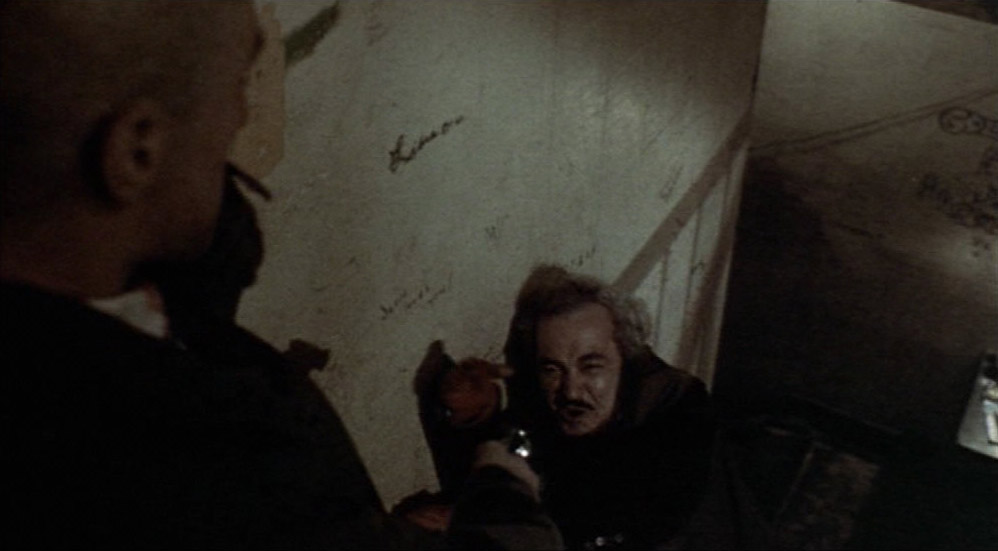
Image resolution: width=998 pixels, height=551 pixels. Find the location of `wall`. wall is located at coordinates [554, 113].